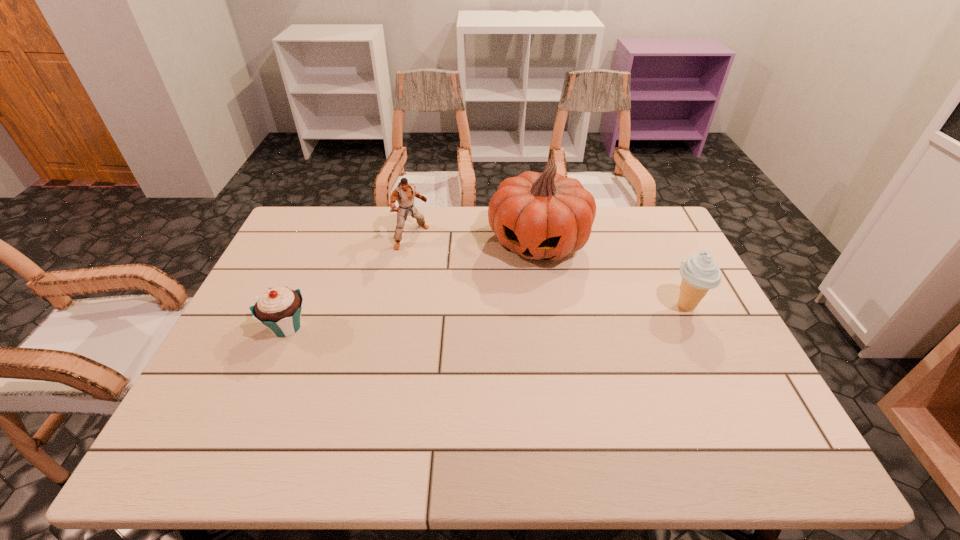
This screenshot has height=540, width=960. I want to click on vacant region between the rightmost object and the leftmost object, so click(x=487, y=316).

Identify the location of free spot between the tallest object and the third object from right to left. This screenshot has height=540, width=960. (475, 240).

Where is `vacant space that's between the rightmost object and the cupcake`? This screenshot has height=540, width=960. vacant space that's between the rightmost object and the cupcake is located at coordinates (487, 316).

Where is `free space between the third object from right to left and the cupcake`? free space between the third object from right to left and the cupcake is located at coordinates (349, 282).

At what (x,y) coordinates should I click in order to perform the action: click on unoccupied area between the puncher and the rightmost object. Please return your answer as a coordinate pair (x, y). Looking at the image, I should click on (549, 272).

Locate which object is the third closest to the pumpkin. Please provide its 2D coordinates. Your answer should be formatted as a tuple, i.e. [(x, y)], where the tuple contains the x and y coordinates of a point satisfying the conditions above.

[(279, 309)]

The width and height of the screenshot is (960, 540). I want to click on the closest object relative to the puncher, so click(540, 216).

Find the location of a particular element. The height and width of the screenshot is (540, 960). free region that satisfies the following two spatial constraints: 1. on the front side of the rightmost object; 2. on the left side of the second object from right to left is located at coordinates (549, 306).

Where is `blank area in the image that satisfies the following two spatial constraints: 1. on the back side of the icecream; 2. on the right side of the shortest object`? blank area in the image that satisfies the following two spatial constraints: 1. on the back side of the icecream; 2. on the right side of the shortest object is located at coordinates (296, 306).

Find the location of a particular element. The image size is (960, 540). vacant region that satisfies the following two spatial constraints: 1. on the back side of the shortest object; 2. on the left side of the puncher is located at coordinates (325, 237).